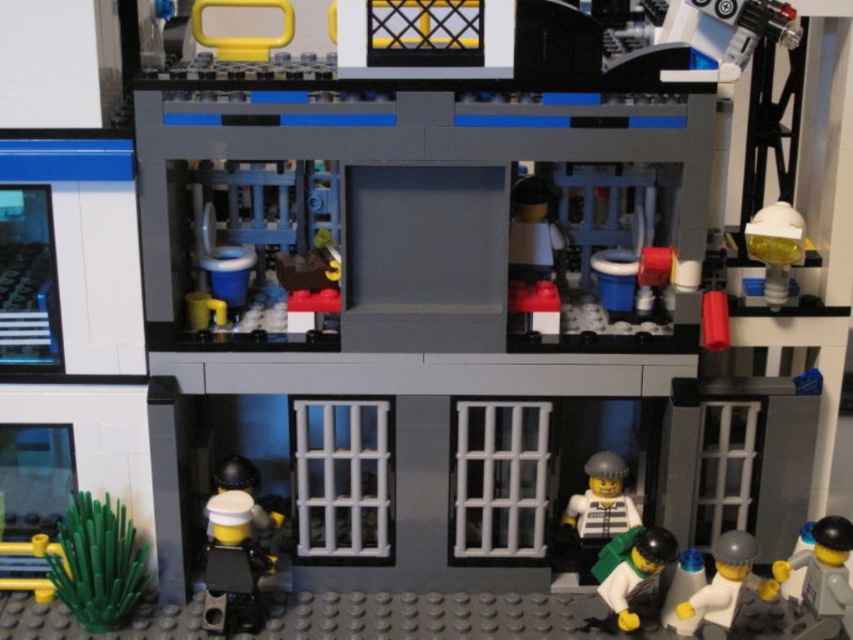
You are a Lego character trying to reach the smooth white minifigure at lower right and the white matte minifigure at lower right. Which one is closer to you?

The smooth white minifigure at lower right is closer to you because it is further to the viewer than the white matte minifigure at lower right.

You are trying to fit both the smooth white minifigure at lower right and the white matte minifigure at lower right into a narrow Lego compartment. Which one can fit through the opening first?

The smooth white minifigure at lower right has a lesser width compared to the white matte minifigure at lower right, so it can fit through the narrow opening first.